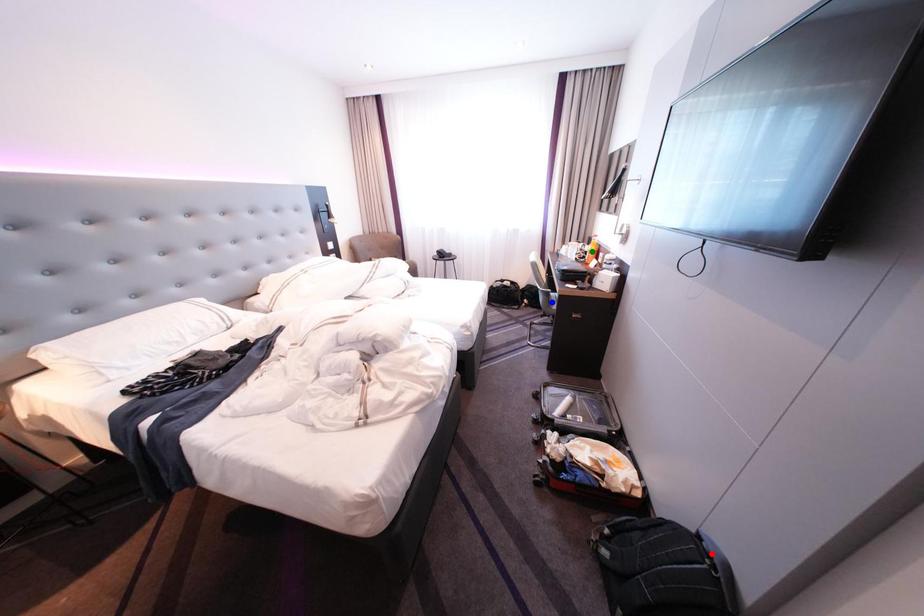
Consider the image. Order these from nearest to farthest:
- green point
- blue point
- red point

red point
green point
blue point